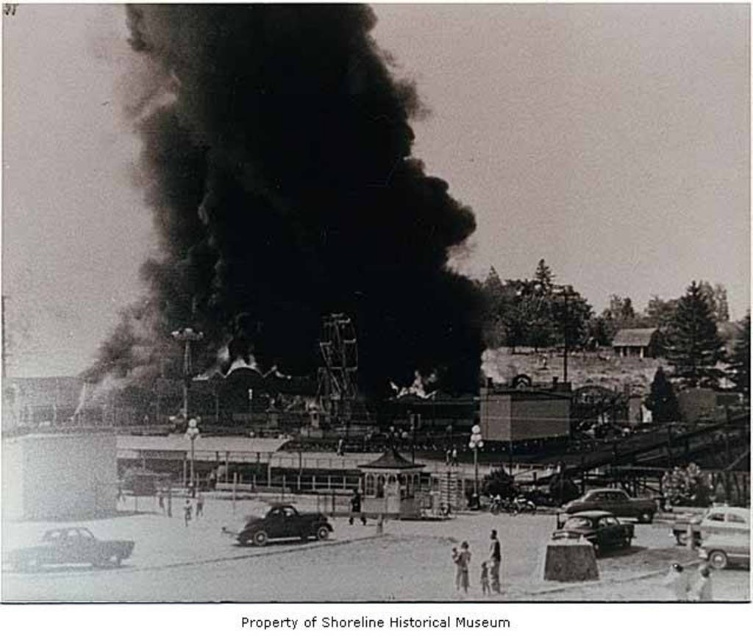
You are standing at the point where the fire is located. You want to reach a safe zone that is 130 meters away from your current position. Is the point at coordinates point (337, 61) within the safe zone?

The point at coordinates point (337, 61) is exactly 129.90 meters away from the viewer, which is within the 130 meters safe zone distance. Therefore, the point is inside the safe zone.